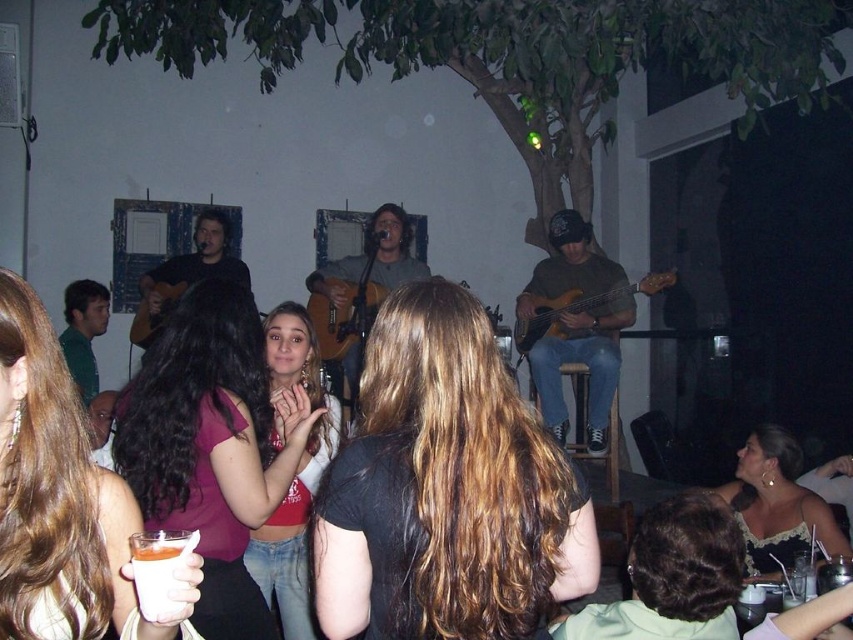
You are a photographer taking a portrait of the performers at the center of the image. You need to ensure that both the pink fabric shirt at center and the matte brown bass guitar at center are fully visible in the frame. Based on their sizes, which object might require you to adjust your camera angle to accommodate its size?

The matte brown bass guitar at center has a greater width than the pink fabric shirt at center, so you might need to adjust your camera angle to ensure it fits within the frame.

You are at the front of the stage and see the brown hair at center and the matte pink shirt at center. Which one is closer to you?

The brown hair at center is closer to the viewer than the matte pink shirt at center.